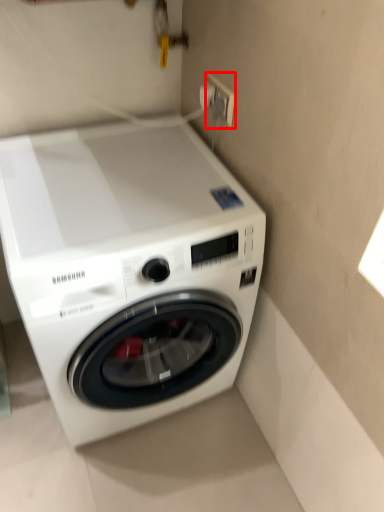
Question: From the image, what is the correct spatial relationship of electric outlet (annotated by the red box) in relation to washing machine?

Choices:
 (A) right
 (B) left

Answer: (A)